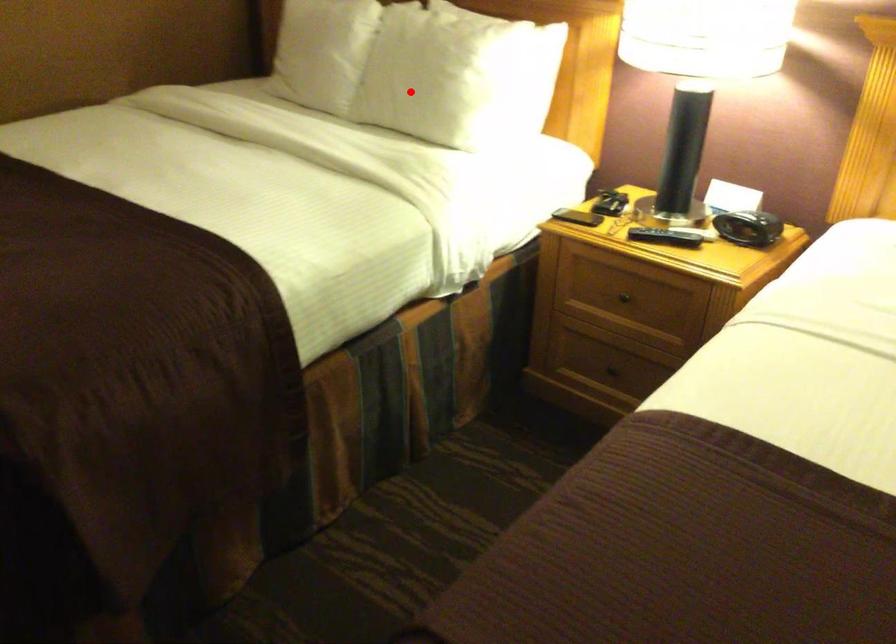
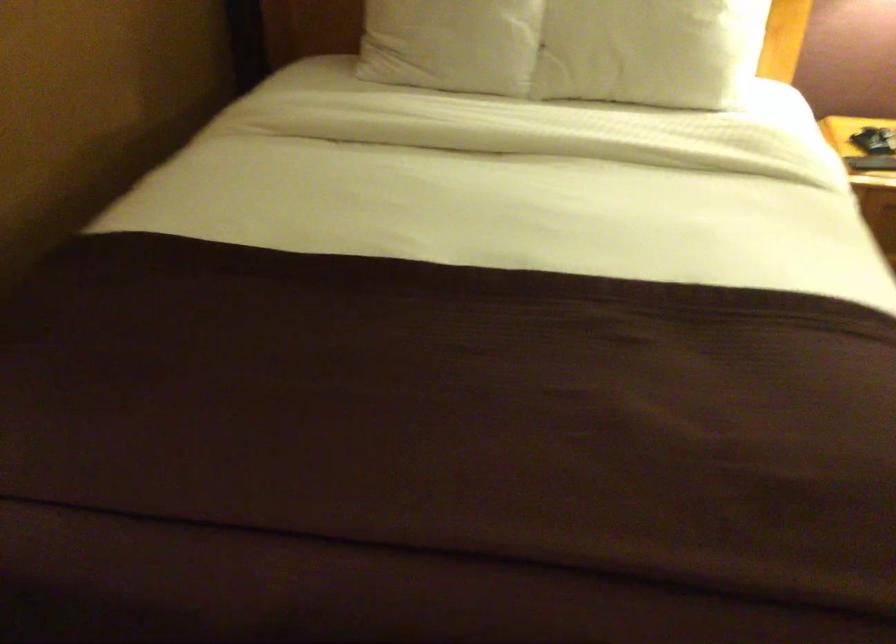
Question: I am providing you with two images of the same scene from different viewpoints. A red point is shown in image1. For the corresponding object point in image2, is it positioned nearer or farther from the camera?

Choices:
 (A) Nearer
 (B) Farther

Answer: (A)